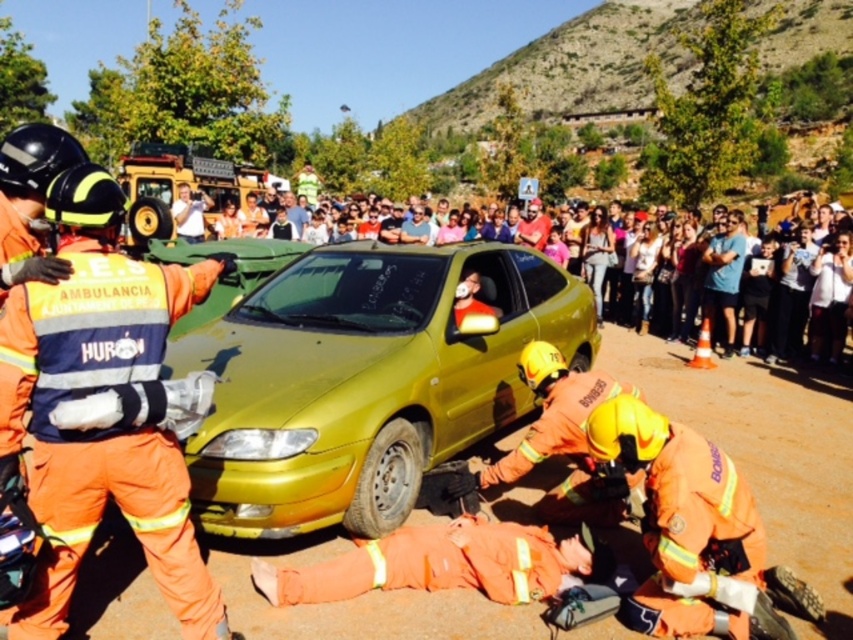
Does orange fabric fireman at left appear on the right side of multicolored casual clothing at upper center?

Incorrect, orange fabric fireman at left is not on the right side of multicolored casual clothing at upper center.

Does orange fabric fireman at left have a lesser height compared to multicolored casual clothing at upper center?

Indeed, orange fabric fireman at left has a lesser height compared to multicolored casual clothing at upper center.

Who is more distant from viewer, (74, 385) or (187, 314)?

The point (187, 314) is behind.

Where is `orange fabric fireman at left`? This screenshot has width=853, height=640. orange fabric fireman at left is located at coordinates (103, 406).

Can you confirm if gold matte car at center is positioned to the left of orange fabric fireman at left?

Incorrect, gold matte car at center is not on the left side of orange fabric fireman at left.

Is gold matte car at center shorter than orange fabric fireman at left?

In fact, gold matte car at center may be taller than orange fabric fireman at left.

The image size is (853, 640). What are the coordinates of `gold matte car at center` in the screenshot? It's located at (364, 380).

Is gold matte car at center below multicolored casual clothing at upper center?

Indeed, gold matte car at center is positioned under multicolored casual clothing at upper center.

Does gold matte car at center appear on the left side of multicolored casual clothing at upper center?

Correct, you'll find gold matte car at center to the left of multicolored casual clothing at upper center.

What are the coordinates of `gold matte car at center` in the screenshot? It's located at (364, 380).

What are the coordinates of `gold matte car at center` in the screenshot? It's located at coord(364,380).